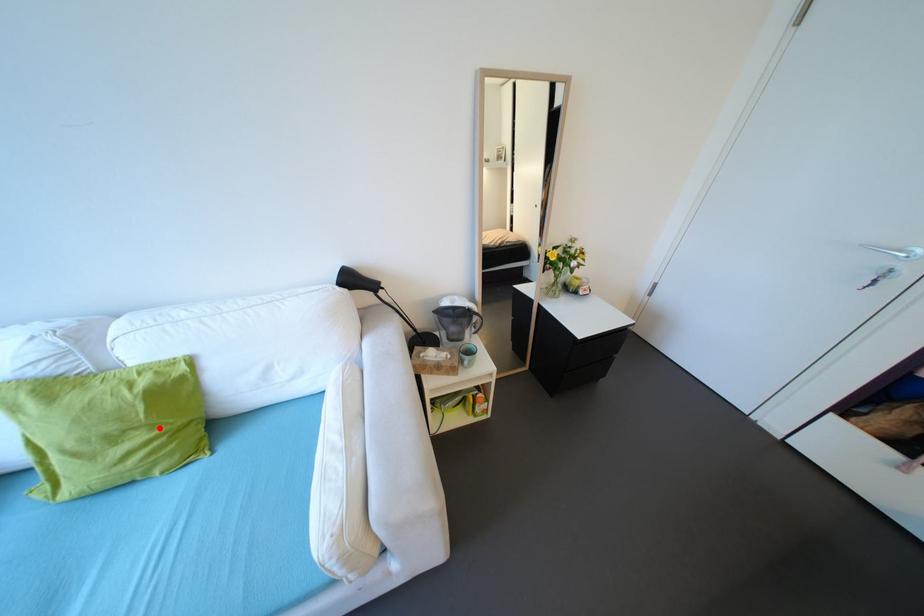
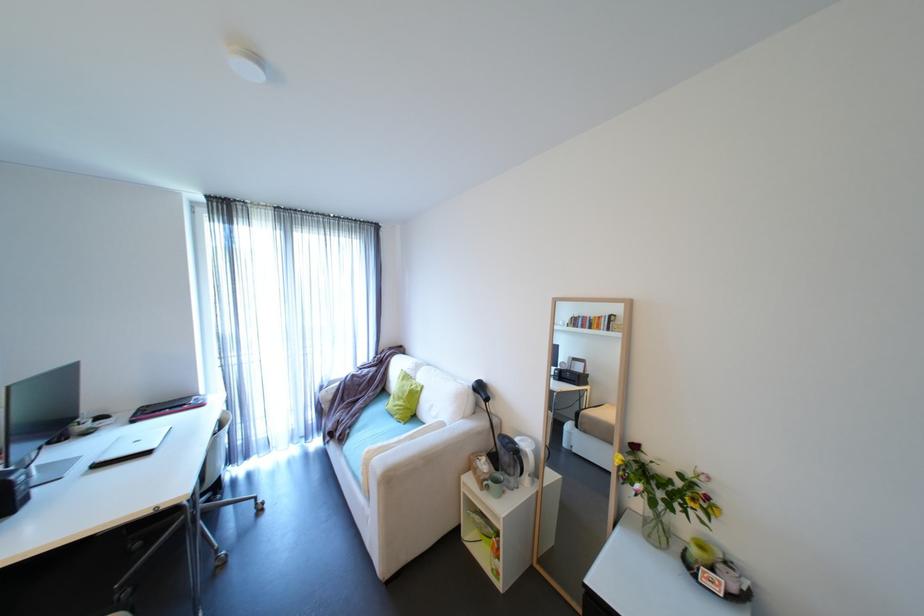
Question: I am providing you with two images of the same scene from different viewpoints. In image1, a red point is highlighted. Considering the same 3D point in image2, which of the following is correct?

Choices:
 (A) It is closer
 (B) It is farther

Answer: (B)